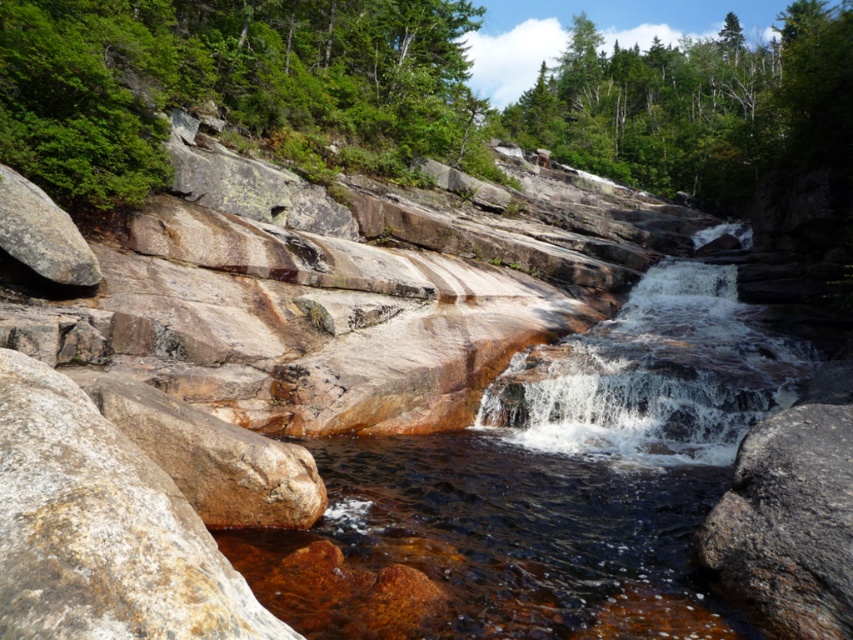
Question: Among these objects, which one is nearest to the camera?

Choices:
 (A) rusty stone stream at center
 (B) translucent water at center
 (C) green rough rock at upper left
 (D) brown rough rock at lower left

Answer: (D)

Question: Does green rough rock at upper left appear on the right side of green leafy tree at upper center?

Choices:
 (A) no
 (B) yes

Answer: (A)

Question: Which object is positioned closest to the brown rough rock at lower left?

Choices:
 (A) green rough rock at upper left
 (B) green leafy tree at upper center
 (C) translucent water at center

Answer: (C)

Question: Does rusty stone stream at center have a lesser width compared to green leafy tree at upper center?

Choices:
 (A) no
 (B) yes

Answer: (B)

Question: Among these objects, which one is farthest from the camera?

Choices:
 (A) translucent water at center
 (B) rusty stone stream at center
 (C) green rough rock at upper left
 (D) brown rough rock at lower left

Answer: (C)

Question: Can you confirm if rusty stone stream at center is positioned to the left of brown rough rock at lower left?

Choices:
 (A) no
 (B) yes

Answer: (A)